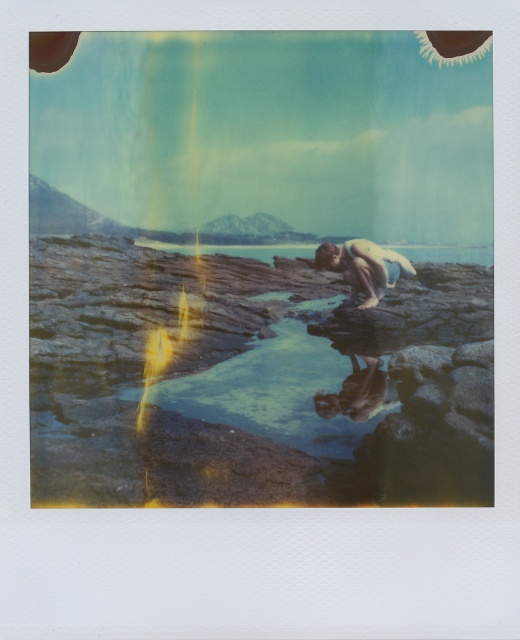
Between point (367, 301) and point (365, 376), which one is positioned behind?

Point (367, 301)

Is smooth skin person at center bigger than smooth stone water at center?

Indeed, smooth skin person at center has a larger size compared to smooth stone water at center.

Which is in front, point (375, 252) or point (366, 384)?

Point (366, 384) is more forward.

Where is `smooth skin person at center`? smooth skin person at center is located at coordinates (362, 266).